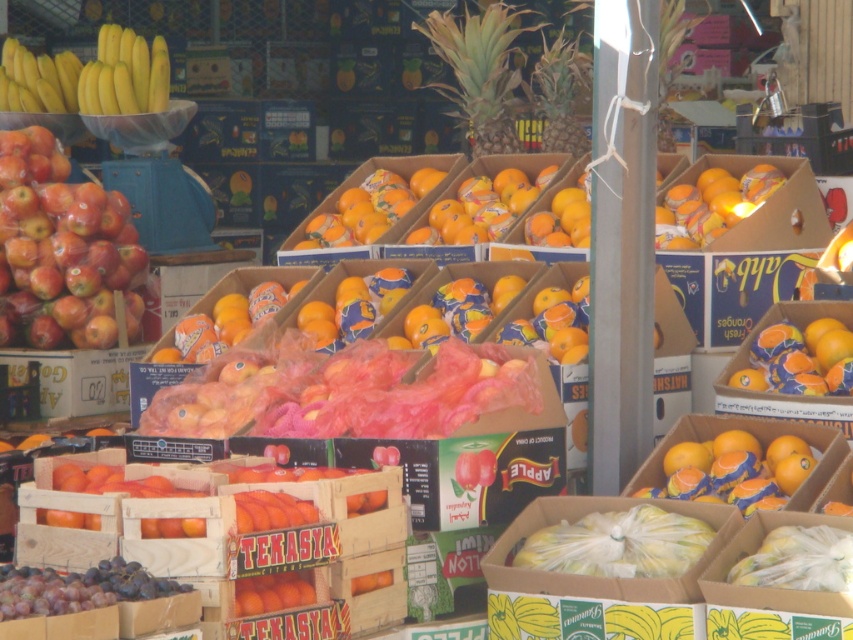
Question: Can you confirm if shiny red apples at left is smaller than yellow matte bananas at upper left?

Choices:
 (A) yes
 (B) no

Answer: (B)

Question: Where is shiny red apples at left located in relation to yellow matte bananas at upper left in the image?

Choices:
 (A) above
 (B) below

Answer: (B)

Question: Which of the following is the farthest from the observer?

Choices:
 (A) yellow matte bananas at upper left
 (B) shiny red apples at left

Answer: (A)

Question: Is shiny red apples at left closer to camera compared to yellow matte bananas at upper left?

Choices:
 (A) no
 (B) yes

Answer: (B)

Question: Which object appears closest to the camera in this image?

Choices:
 (A) shiny red apples at left
 (B) yellow matte bananas at upper left

Answer: (A)